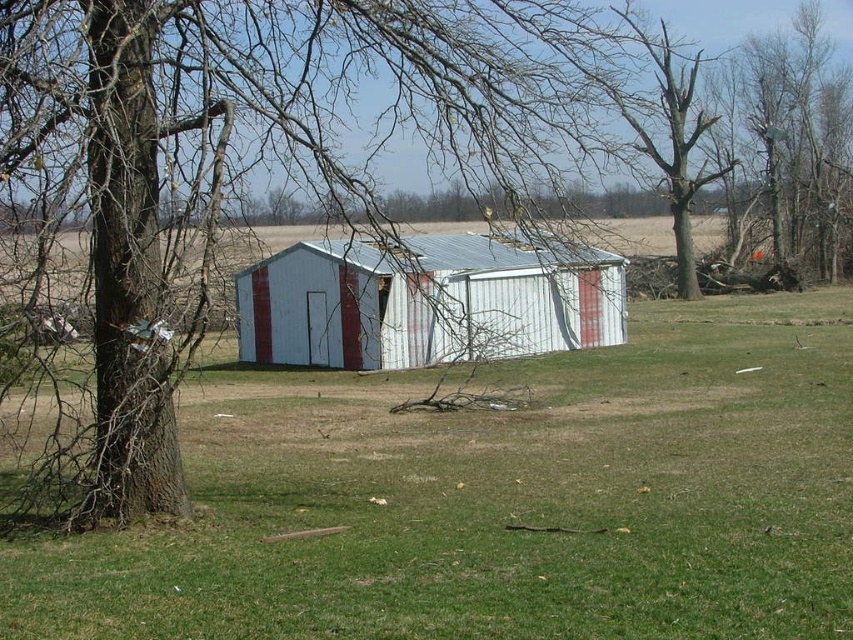
Question: Does brown bark tree at left lie in front of white corrugated metal shed at center?

Choices:
 (A) yes
 (B) no

Answer: (A)

Question: Which of these objects is positioned closest to the bare wood tree at upper right?

Choices:
 (A) green grass at center
 (B) brown bark tree at left

Answer: (B)

Question: Which point appears closest to the camera in this image?

Choices:
 (A) (160, 320)
 (B) (796, 346)

Answer: (A)

Question: Which point is farther to the camera?

Choices:
 (A) (292, 148)
 (B) (380, 458)
 (C) (784, 35)
 (D) (346, 262)

Answer: (C)

Question: Can you confirm if green grass at center is wider than bare wood tree at upper right?

Choices:
 (A) no
 (B) yes

Answer: (B)

Question: Is brown bark tree at left smaller than white corrugated metal shed at center?

Choices:
 (A) no
 (B) yes

Answer: (A)